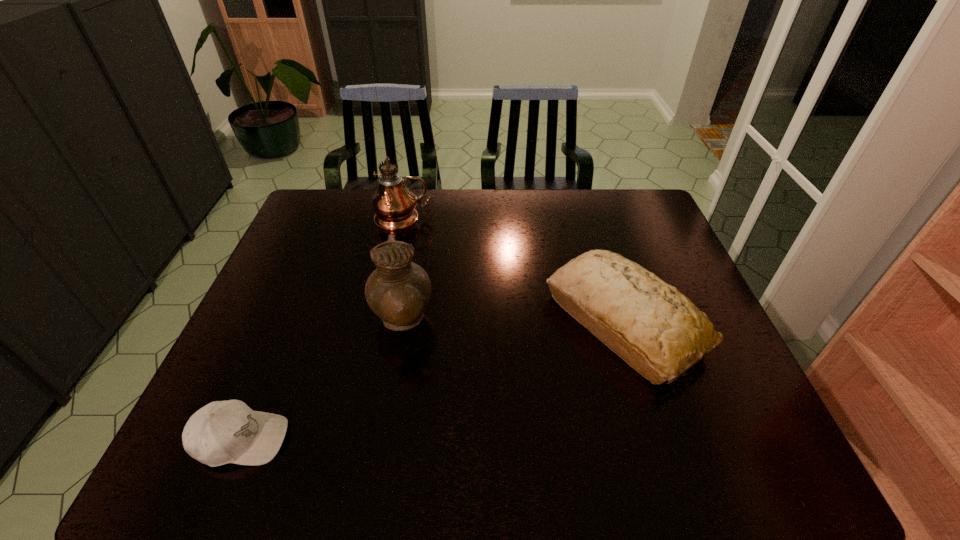
At what (x,y) coordinates should I click in order to perform the action: click on free space that satisfies the following two spatial constraints: 1. at the spout of the third shortest object; 2. on the back side of the rightmost object. Please return your answer as a coordinate pair (x, y). Looking at the image, I should click on (402, 322).

You are a GUI agent. You are given a task and a screenshot of the screen. Output one action in this format:
    pyautogui.click(x=<x>, y=<y>)
    Task: Click on the free location that satisfies the following two spatial constraints: 1. at the spout of the third shortest object; 2. on the left side of the bread
    The image size is (960, 540).
    Given the screenshot: What is the action you would take?
    pyautogui.click(x=402, y=322)